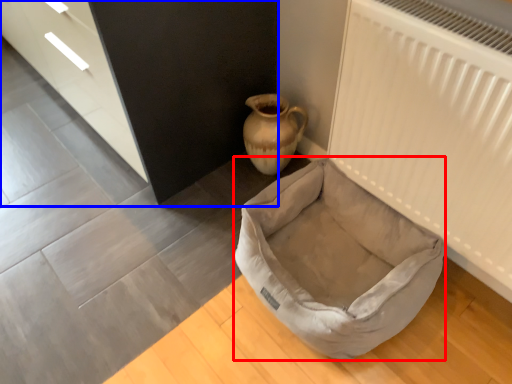
Question: Which of the following is the closest to the observer, dog bed (highlighted by a red box) or dresser (highlighted by a blue box)?

Choices:
 (A) dog bed
 (B) dresser

Answer: (A)